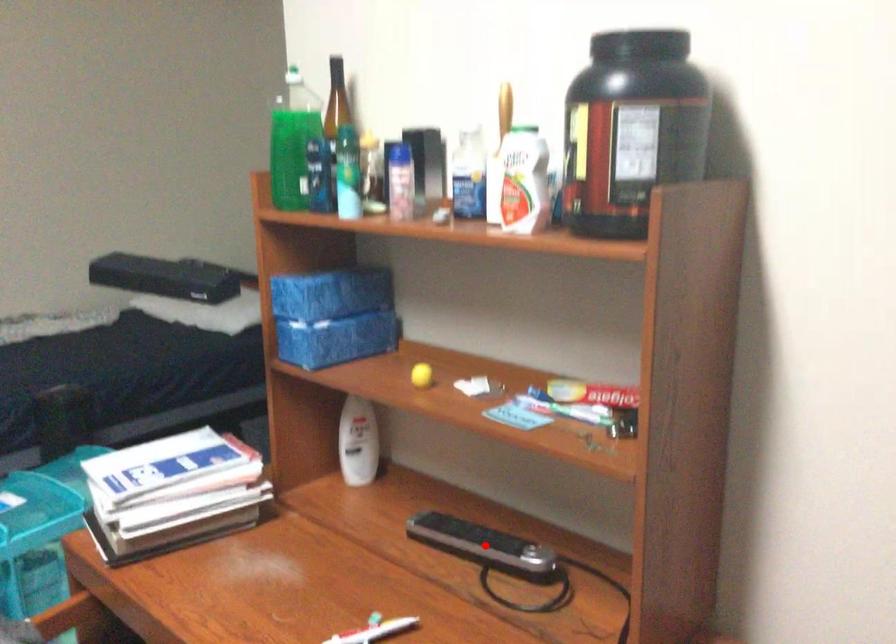
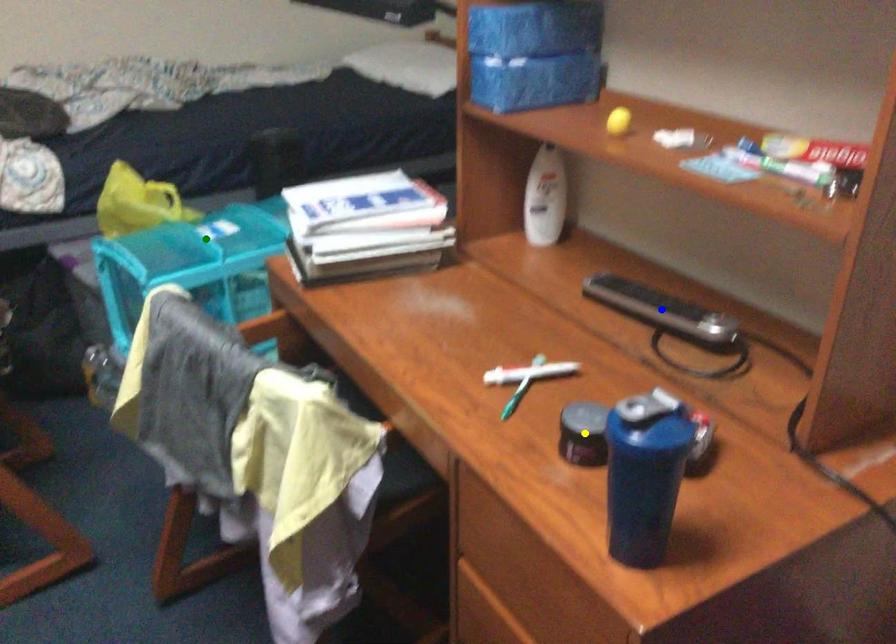
Question: I am providing you with two images of the same scene from different viewpoints. A red point is marked on the first image. You are given multiple points on the second image. Which point in image 2 is actually the same real-world point as the red point in image 1?

Choices:
 (A) yellow point
 (B) blue point
 (C) green point

Answer: (B)